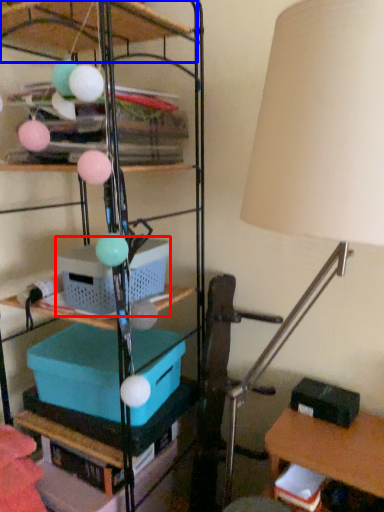
Question: Among these objects, which one is nearest to the camera, storage box (highlighted by a red box) or shelf (highlighted by a blue box)?

Choices:
 (A) storage box
 (B) shelf

Answer: (B)